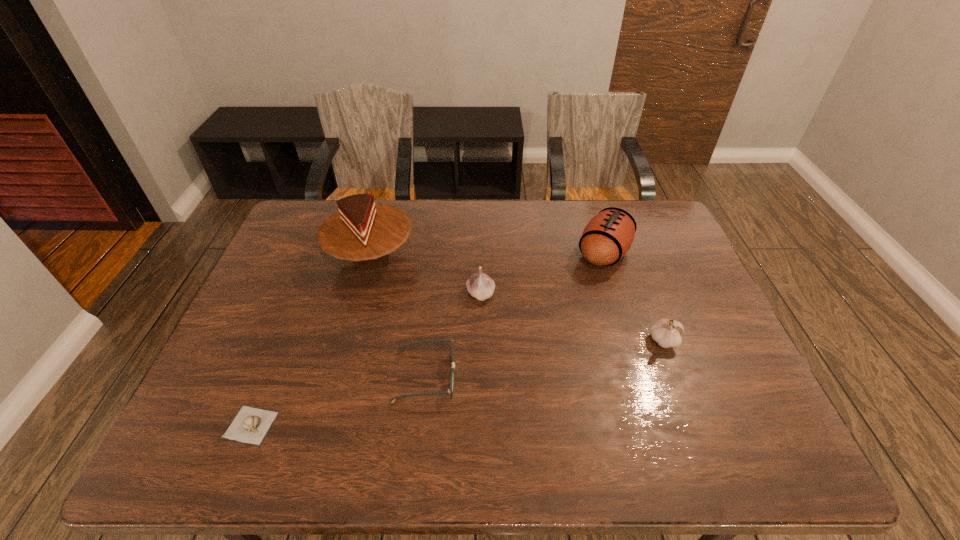
What are the coordinates of `vacant space located 0.140m on the back of the second garlic from left to right` in the screenshot? It's located at (481, 252).

At what (x,y) coordinates should I click in order to perform the action: click on free space located 0.280m on the back of the second nearest garlic. Please return your answer as a coordinate pair (x, y). The image size is (960, 540). Looking at the image, I should click on (634, 259).

What are the coordinates of `vacant space situated 0.110m on the face of the fifth tallest object` in the screenshot? It's located at (501, 376).

Find the location of a particular element. blank area located on the right of the shortest object is located at coordinates (306, 425).

Where is `cake that is positioned at the far edge`? The height and width of the screenshot is (540, 960). cake that is positioned at the far edge is located at coordinates (362, 231).

The height and width of the screenshot is (540, 960). Find the location of `football (American) at the far edge`. football (American) at the far edge is located at coordinates (607, 237).

The image size is (960, 540). I want to click on object at the near edge, so click(250, 425).

Identify the location of object located at the left edge. The height and width of the screenshot is (540, 960). (250, 425).

Identify the location of football (American) that is at the right edge. The width and height of the screenshot is (960, 540). (607, 237).

Find the location of a particular element. This screenshot has width=960, height=540. garlic that is at the right edge is located at coordinates (666, 332).